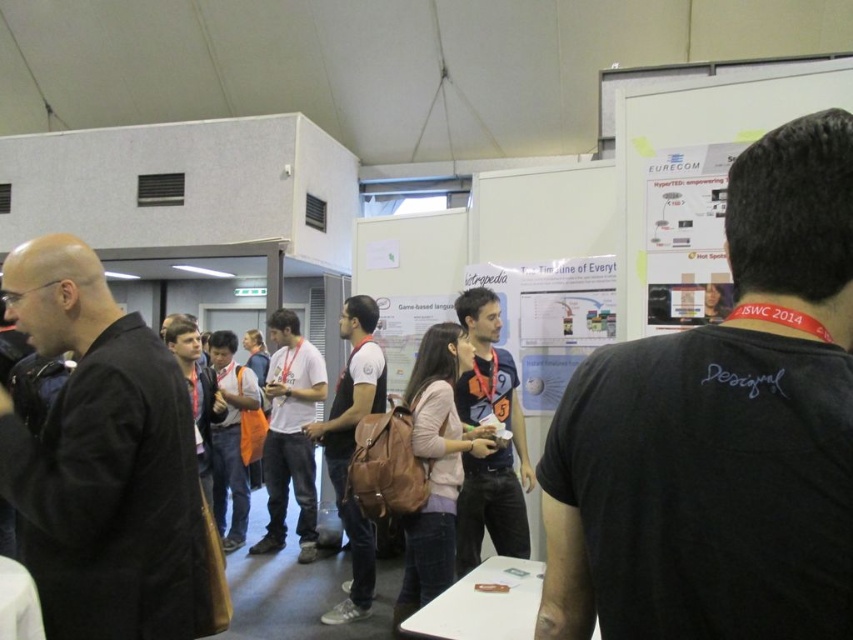
Question: Estimate the real-world distances between objects in this image. Which object is closer to the black t-shirt at upper right?

Choices:
 (A) dark blue t-shirt at center
 (B) brown leather backpack at center
 (C) white paperboard at upper right

Answer: (C)

Question: Which of these objects is positioned farthest from the orange fabric backpack at center?

Choices:
 (A) black t-shirt at upper right
 (B) brown leather backpack at center

Answer: (A)

Question: Based on their relative distances, which object is nearer to the orange fabric backpack at center?

Choices:
 (A) white paperboard at upper right
 (B) brown leather backpack at center
 (C) white cotton shirt at center

Answer: (C)

Question: Is black t-shirt at upper right to the right of dark blue t-shirt at center from the viewer's perspective?

Choices:
 (A) no
 (B) yes

Answer: (B)

Question: Does black fabric jacket at left have a larger size compared to white paperboard at upper right?

Choices:
 (A) yes
 (B) no

Answer: (B)

Question: Is black fabric jacket at left wider than dark blue t-shirt at center?

Choices:
 (A) no
 (B) yes

Answer: (B)